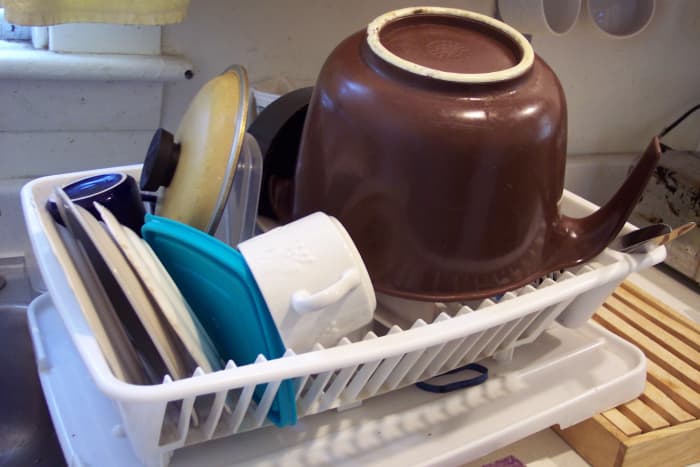
Find the location of `tupperware container`. tupperware container is located at coordinates (238, 188).